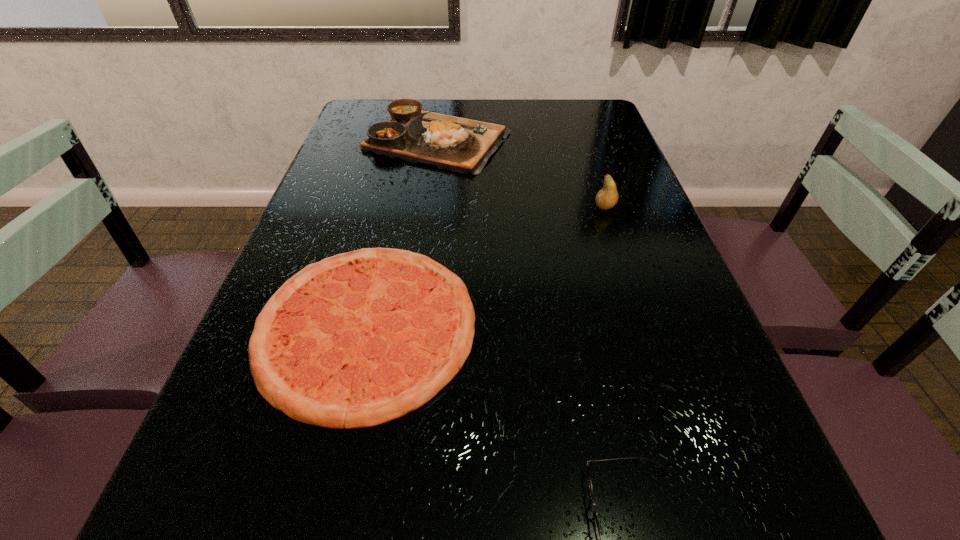
Select which object is the closest to the spectacles. Please provide its 2D coordinates. Your answer should be formatted as a tuple, i.e. [(x, y)], where the tuple contains the x and y coordinates of a point satisfying the conditions above.

[(361, 338)]

Point out which object is positioned as the third nearest to the third farthest object. Please provide its 2D coordinates. Your answer should be formatted as a tuple, i.e. [(x, y)], where the tuple contains the x and y coordinates of a point satisfying the conditions above.

[(607, 197)]